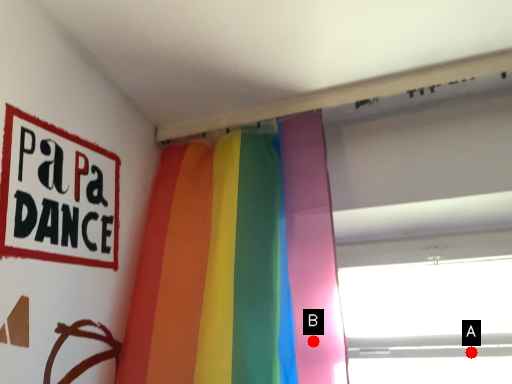
Question: Two points are circled on the image, labeled by A and B beside each circle. Which point is further to the camera?

Choices:
 (A) A is further
 (B) B is further

Answer: (A)